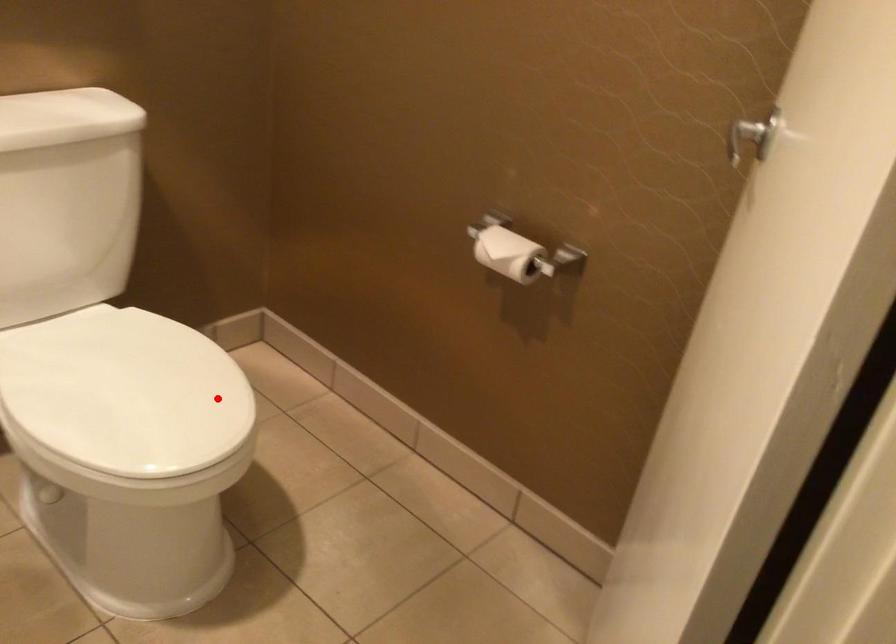
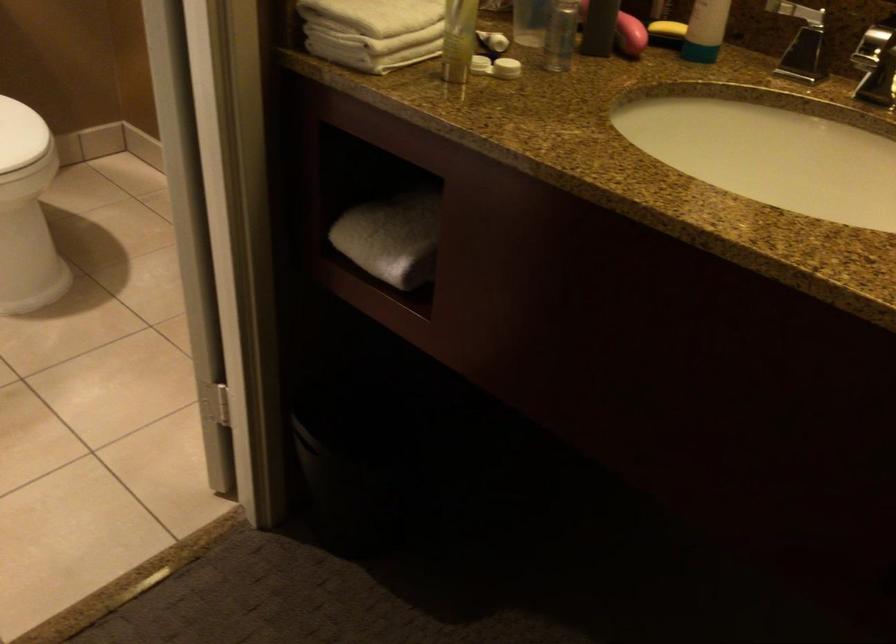
Find the pixel in the second image that matches the highlighted location in the first image.

(20, 135)